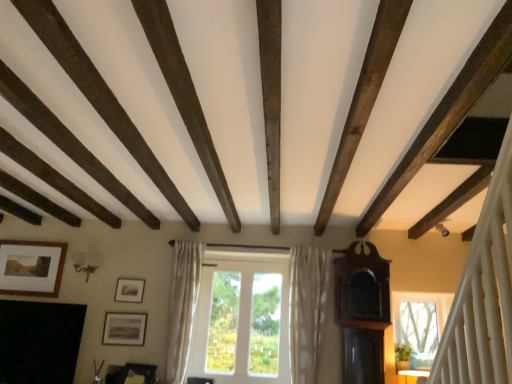
Question: Is point (116, 379) positioned closer to the camera than point (36, 288)?

Choices:
 (A) farther
 (B) closer

Answer: (B)

Question: In the image, is wooden picture frame at lower center positioned in front of or behind wooden framed picture at upper left, the first picture frame when ordered from left to right?

Choices:
 (A) front
 (B) behind

Answer: (A)

Question: Which object is positioned closest to the wooden framed picture at upper left, the first picture frame when ordered from top to bottom?

Choices:
 (A) white glass window at center
 (B) white dotted fabric curtain at center, marked as the 1th curtain in a right-to-left arrangement
 (C) white sheer curtain at center, the first curtain from the left
 (D) wooden picture frame at lower center
 (E) black matte fireplace at lower left

Answer: (E)

Question: Estimate the real-world distances between objects in this image. Which object is closer to the white sheer curtain at center, the first curtain from the left?

Choices:
 (A) wooden picture frame at lower center
 (B) white dotted fabric curtain at center, marked as the 1th curtain in a right-to-left arrangement
 (C) wooden framed picture at upper left, the 3th picture frame when ordered from right to left
 (D) white glass window at center
 (E) black matte fireplace at lower left

Answer: (D)